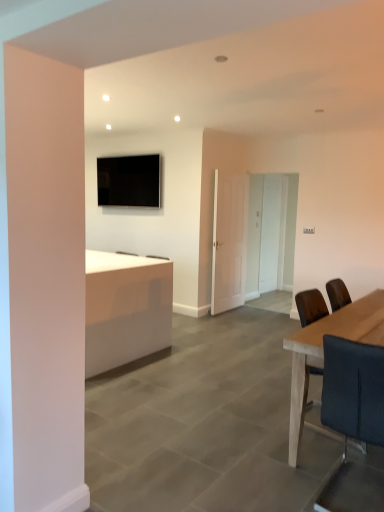
Question: Would you say white matte door at center is part of light brown wooden table at right's contents?

Choices:
 (A) no
 (B) yes

Answer: (A)

Question: Can you confirm if light brown wooden table at right is thinner than white matte door at center?

Choices:
 (A) no
 (B) yes

Answer: (A)

Question: From a real-world perspective, does light brown wooden table at right stand above white matte door at center?

Choices:
 (A) yes
 (B) no

Answer: (B)

Question: Does light brown wooden table at right have a greater width compared to white matte door at center?

Choices:
 (A) no
 (B) yes

Answer: (B)

Question: Does light brown wooden table at right have a larger size compared to white matte door at center?

Choices:
 (A) no
 (B) yes

Answer: (B)

Question: Looking at their shapes, would you say white matte door at center is wider or thinner than black leather chair at right?

Choices:
 (A) wide
 (B) thin

Answer: (B)

Question: Considering the positions of white matte door at center and black leather chair at right in the image, is white matte door at center taller or shorter than black leather chair at right?

Choices:
 (A) tall
 (B) short

Answer: (A)

Question: In the image, is white matte door at center on the left side or the right side of black leather chair at right?

Choices:
 (A) right
 (B) left

Answer: (B)

Question: From the image's perspective, relative to black leather chair at right, is white matte door at center above or below?

Choices:
 (A) above
 (B) below

Answer: (A)

Question: From a real-world perspective, relative to black leather chair at right, is white glossy desk at center vertically above or below?

Choices:
 (A) above
 (B) below

Answer: (B)

Question: Considering their positions, is white glossy desk at center located in front of or behind black leather chair at right?

Choices:
 (A) behind
 (B) front

Answer: (A)

Question: Is white glossy desk at center wider or thinner than black leather chair at right?

Choices:
 (A) thin
 (B) wide

Answer: (B)

Question: From their relative heights in the image, would you say white glossy desk at center is taller or shorter than black leather chair at right?

Choices:
 (A) tall
 (B) short

Answer: (A)

Question: Which is correct: white matte door at center is inside matte black tv at upper center, or outside of it?

Choices:
 (A) inside
 (B) outside

Answer: (B)

Question: Based on their positions, is white matte door at center located to the left or right of matte black tv at upper center?

Choices:
 (A) right
 (B) left

Answer: (A)